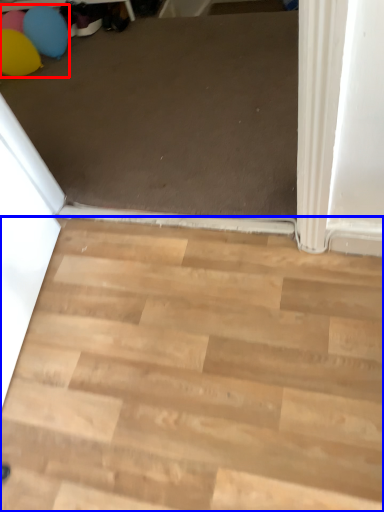
Question: Among these objects, which one is nearest to the camera, balloon (highlighted by a red box) or stairwell (highlighted by a blue box)?

Choices:
 (A) balloon
 (B) stairwell

Answer: (B)